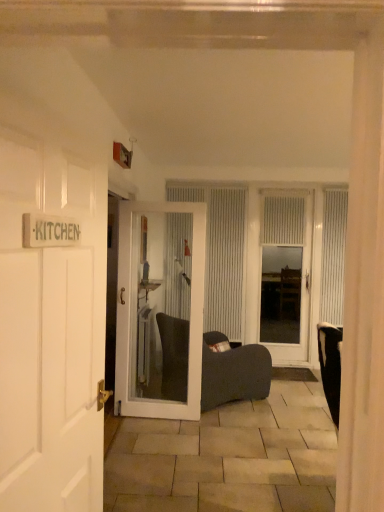
Question: Is white textured curtain at center, placed as the third curtain when sorted from right to left, positioned far away from white textured curtain at center, which ranks as the second curtain in right-to-left order?

Choices:
 (A) no
 (B) yes

Answer: (A)

Question: Is white textured curtain at center, placed as the third curtain when sorted from right to left, next to white textured curtain at center, which is the 2th curtain in left-to-right order, and touching it?

Choices:
 (A) no
 (B) yes

Answer: (A)

Question: Is white textured curtain at center, placed as the 1th curtain when sorted from left to right, taller than white textured curtain at center, which is the 2th curtain in left-to-right order?

Choices:
 (A) yes
 (B) no

Answer: (A)

Question: From the image's perspective, is white textured curtain at center, placed as the 1th curtain when sorted from left to right, located above white textured curtain at center, which is the 2th curtain in left-to-right order?

Choices:
 (A) yes
 (B) no

Answer: (B)

Question: From a real-world perspective, is white textured curtain at center, placed as the third curtain when sorted from right to left, on white textured curtain at center, which ranks as the second curtain in right-to-left order?

Choices:
 (A) no
 (B) yes

Answer: (A)

Question: Can you confirm if white textured curtain at center, placed as the third curtain when sorted from right to left, is bigger than white textured curtain at center, which ranks as the second curtain in right-to-left order?

Choices:
 (A) yes
 (B) no

Answer: (A)

Question: Does white glass door at center, which is the 1th door in right-to-left order, come in front of dark fabric chair at center?

Choices:
 (A) yes
 (B) no

Answer: (B)

Question: Is white glass door at center, which is the 1th door in right-to-left order, to the left of dark fabric chair at center from the viewer's perspective?

Choices:
 (A) yes
 (B) no

Answer: (B)

Question: From a real-world perspective, is white glass door at center, which is the 1th door in right-to-left order, positioned over dark fabric chair at center based on gravity?

Choices:
 (A) yes
 (B) no

Answer: (A)

Question: Could you tell me if white glass door at center, which is the 1th door in right-to-left order, is turned towards dark fabric chair at center?

Choices:
 (A) yes
 (B) no

Answer: (B)

Question: Is white glass door at center, the first door from the back, further to camera compared to dark fabric chair at center?

Choices:
 (A) no
 (B) yes

Answer: (B)

Question: From a real-world perspective, is white glass door at center, the third door when ordered from front to back, below dark fabric chair at center?

Choices:
 (A) no
 (B) yes

Answer: (A)

Question: Does white textured curtain at center, placed as the 1th curtain when sorted from left to right, have a lesser height compared to white glossy door at center, placed as the second door when sorted from right to left?

Choices:
 (A) no
 (B) yes

Answer: (A)